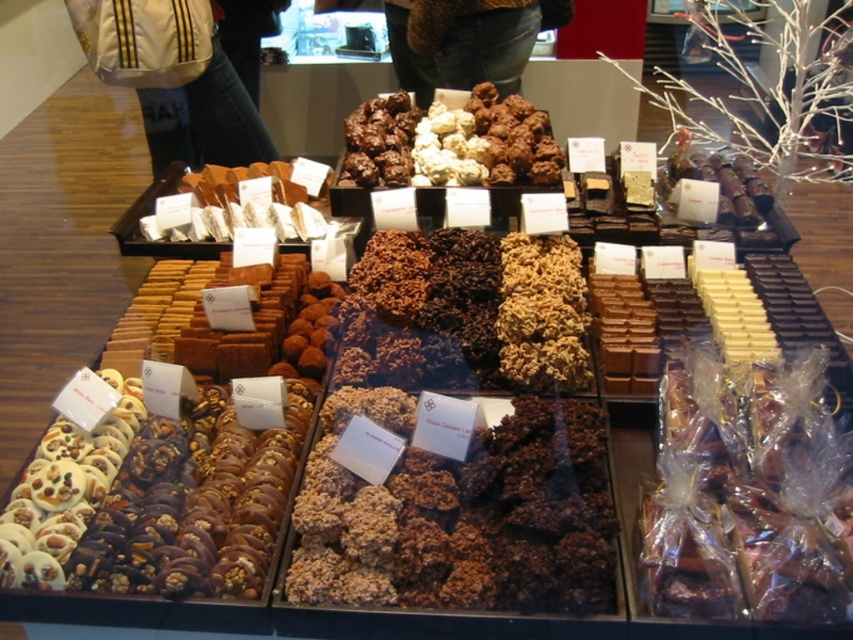
Question: Can you confirm if translucent plastic wrapped chocolates at lower right is positioned above brown wool sweater at upper center?

Choices:
 (A) yes
 (B) no

Answer: (B)

Question: Estimate the real-world distances between objects in this image. Which object is closer to the chocolate crumbly at center?

Choices:
 (A) white chocolate bar at center
 (B) white fabric bag at upper left

Answer: (A)

Question: Which object is positioned closest to the chocolate truffle at center?

Choices:
 (A) white fabric bag at upper left
 (B) brown wool sweater at upper center

Answer: (A)

Question: Is chocolate crumbly at center below brown wool sweater at upper center?

Choices:
 (A) yes
 (B) no

Answer: (A)

Question: Is the position of white fabric bag at upper left more distant than that of chocolate truffle at center?

Choices:
 (A) yes
 (B) no

Answer: (A)

Question: Among these objects, which one is farthest from the camera?

Choices:
 (A) white chocolate bar at center
 (B) chocolate truffle at center
 (C) brown wool sweater at upper center

Answer: (C)